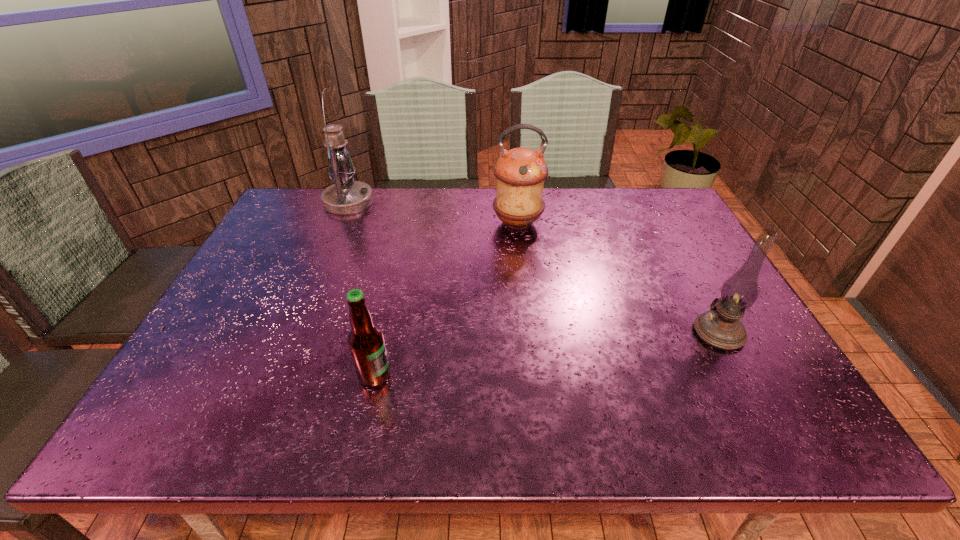
The image size is (960, 540). In order to click on vacant point located between the beer bottle and the rightmost object in this screenshot , I will do `click(546, 354)`.

The height and width of the screenshot is (540, 960). What are the coordinates of `free space between the rightmost oil lamp and the third object from right to left` in the screenshot? It's located at (546, 354).

This screenshot has width=960, height=540. Identify the location of vacant area between the third object from right to left and the leftmost object. pyautogui.click(x=362, y=288).

I want to click on free area in between the leftmost object and the rightmost oil lamp, so click(534, 267).

Locate an element on the screen. unoccupied position between the rightmost object and the third object from left to right is located at coordinates (618, 278).

The width and height of the screenshot is (960, 540). I want to click on vacant space that's between the nearest oil lamp and the nearest object, so click(546, 354).

Locate an element on the screen. unoccupied position between the second object from right to left and the leftmost oil lamp is located at coordinates (433, 212).

Find the location of a particular element. vacant point located between the leftmost object and the second oil lamp from left to right is located at coordinates (433, 212).

Locate an element on the screen. object that stands as the second closest to the leftmost oil lamp is located at coordinates (366, 343).

Identify which object is the second nearest to the third object from right to left. Please provide its 2D coordinates. Your answer should be formatted as a tuple, i.e. [(x, y)], where the tuple contains the x and y coordinates of a point satisfying the conditions above.

[(346, 196)]